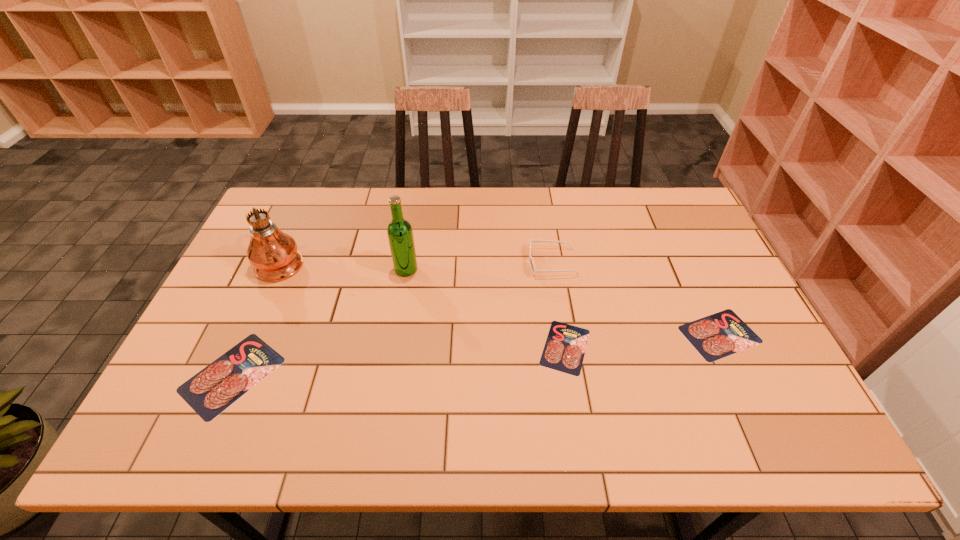
The width and height of the screenshot is (960, 540). I want to click on vacant space in between the fourth shortest object and the shortest salami, so click(x=559, y=305).

Find the location of a particular element. Image resolution: width=960 pixels, height=540 pixels. vacant point located between the second tallest salami and the leftmost salami is located at coordinates (476, 355).

Image resolution: width=960 pixels, height=540 pixels. In order to click on free space that is in between the fifth tallest object and the sunglasses in this screenshot , I will do `click(636, 299)`.

This screenshot has width=960, height=540. What are the coordinates of `empty location between the tallest object and the rightmost salami` in the screenshot? It's located at (500, 298).

Locate an element on the screen. object that is the fourth closest to the second shortest object is located at coordinates (212, 390).

Point out which object is positioned as the nearest to the fifth tallest object. Please provide its 2D coordinates. Your answer should be formatted as a tuple, i.e. [(x, y)], where the tuple contains the x and y coordinates of a point satisfying the conditions above.

[(564, 350)]

Locate an element on the screen. the second closest salami to the sunglasses is located at coordinates (716, 336).

Select which salami appears as the closest to the leftmost salami. Please provide its 2D coordinates. Your answer should be formatted as a tuple, i.e. [(x, y)], where the tuple contains the x and y coordinates of a point satisfying the conditions above.

[(564, 350)]

This screenshot has width=960, height=540. What are the coordinates of `blank area in the image that satisfies the following two spatial constraints: 1. with the lenses of the second shortest salami facing outward; 2. on the left side of the fourth shortest object` in the screenshot? It's located at (564, 334).

In order to click on free space that satisfies the following two spatial constraints: 1. on the front side of the oil lamp; 2. on the left side of the beer bottle in this screenshot , I will do `click(277, 269)`.